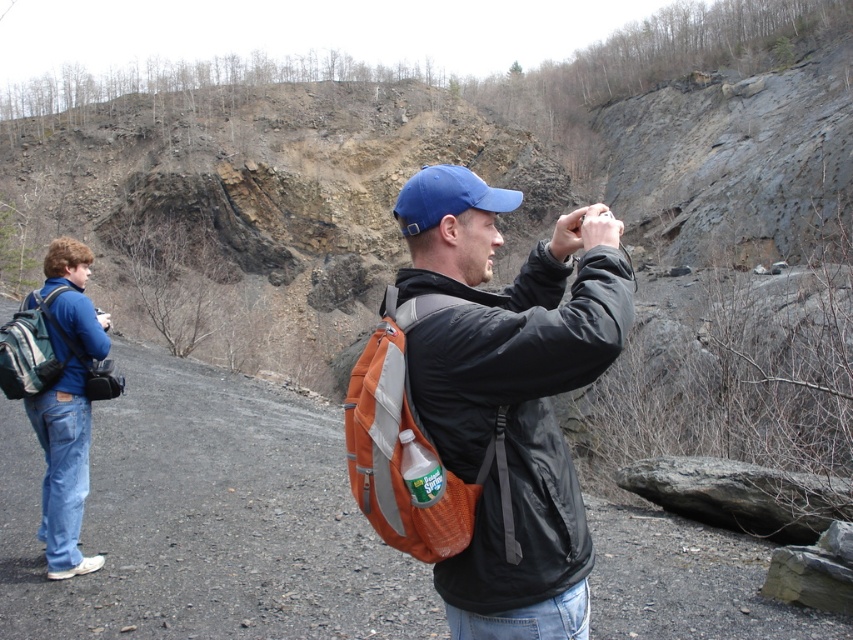
You are navigating a rocky path in the quarry and need to step between two points marked as point (x=61, y=316) and point (x=45, y=380). Which point should you step on first to move closer to the photographer?

Point (x=61, y=316) is further to the viewer than point (x=45, y=380), so you should step on point (x=61, y=316) first to move closer to the photographer.

You are planning to take a photo of the two objects mentioned in the scene. Since the matte black jacket at center and the blue fabric baseball cap at center are both at the center, how can you ensure both are fully visible in your shot?

The matte black jacket at center is positioned under the blue fabric baseball cap at center, so tilting the camera slightly upward or adjusting the angle to capture both the lower positioned jacket and the cap above it will ensure both are fully visible.

You are navigating a rocky terrain and need to reach the blue denim jeans at left. Based on the coordinates provided, which direction should you move relative to your current position?

The blue denim jeans at left is located at coordinates point (67, 404). To reach it, you should move towards the left and slightly forward.